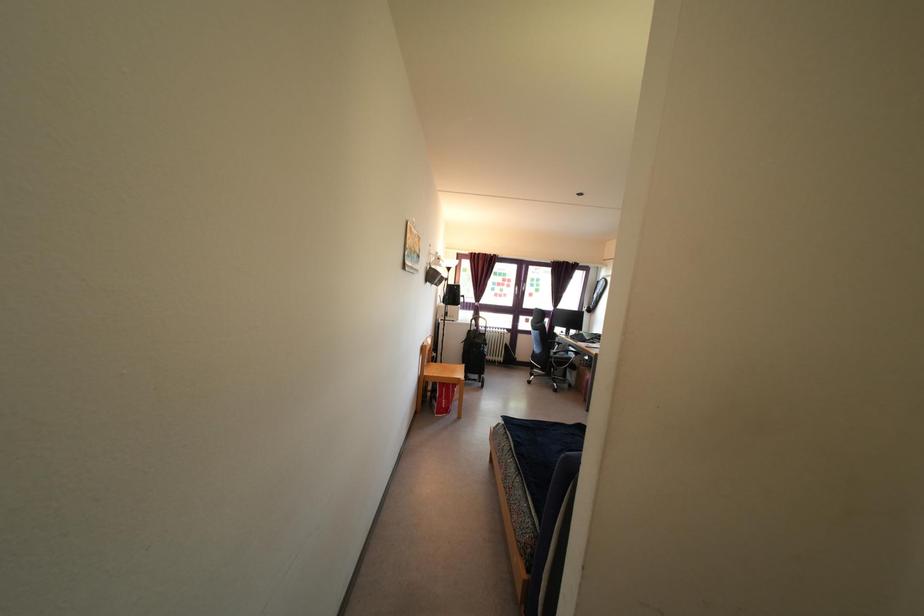
Find where to sit the sofa sitting surface. Please return your answer as a coordinate pair (x, y).

(541, 451)